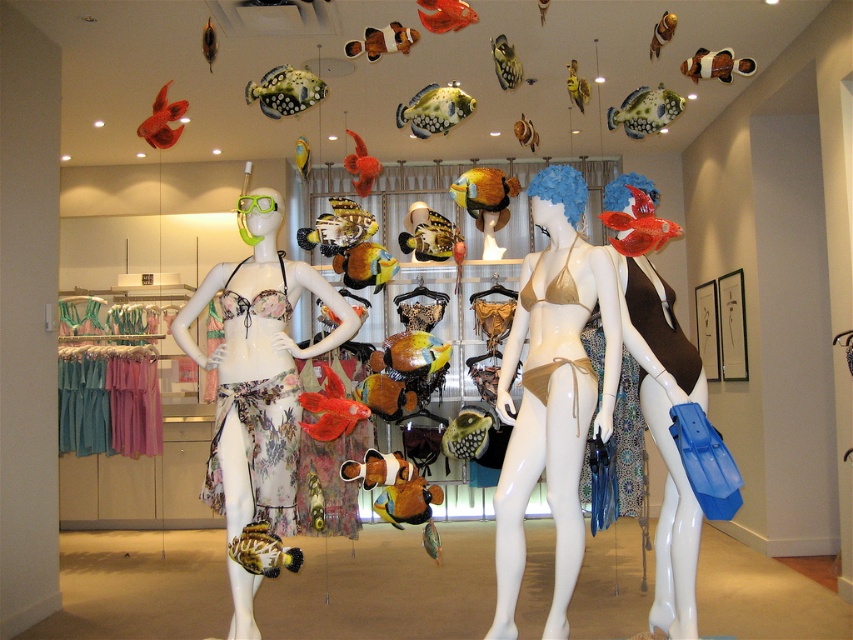
You are a customer trying to decide between two swimwear options displayed in the store. You see the floral fabric bikini top at left and the matte brown swimsuit at center. Which swimsuit has a shorter length?

The floral fabric bikini top at left is shorter than the matte brown swimsuit at center, so the floral fabric bikini top at left has a shorter length.

You are a customer in a swimwear store and want to try on the floral fabric bikini top at left and the matte gold bikini top at center. Which one should you pick up first to try on if you are standing in front of the display?

You should pick up the floral fabric bikini top at left first because it is closer to you than the matte gold bikini top at center, so it is easier to reach.